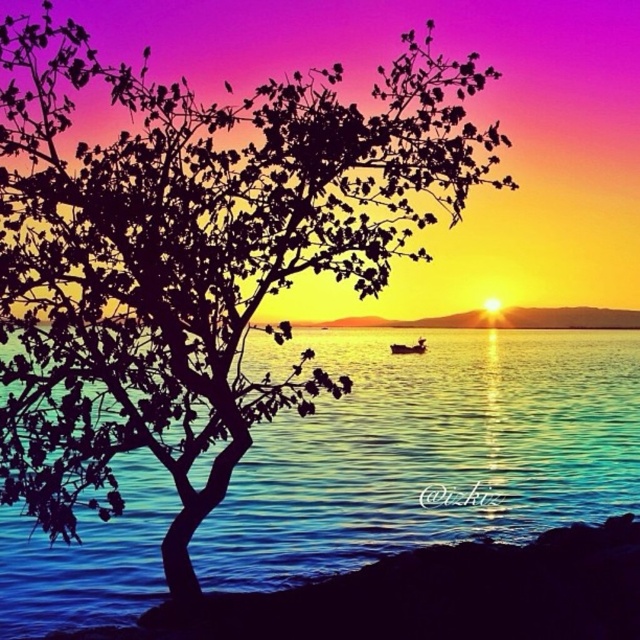
This screenshot has height=640, width=640. What do you see at coordinates (435, 449) in the screenshot?
I see `blue liquid water at center` at bounding box center [435, 449].

Who is shorter, blue liquid water at center or wooden boat at center?

wooden boat at center

Who is more forward, (429,518) or (417,346)?

Point (429,518) is more forward.

I want to click on blue liquid water at center, so click(x=435, y=449).